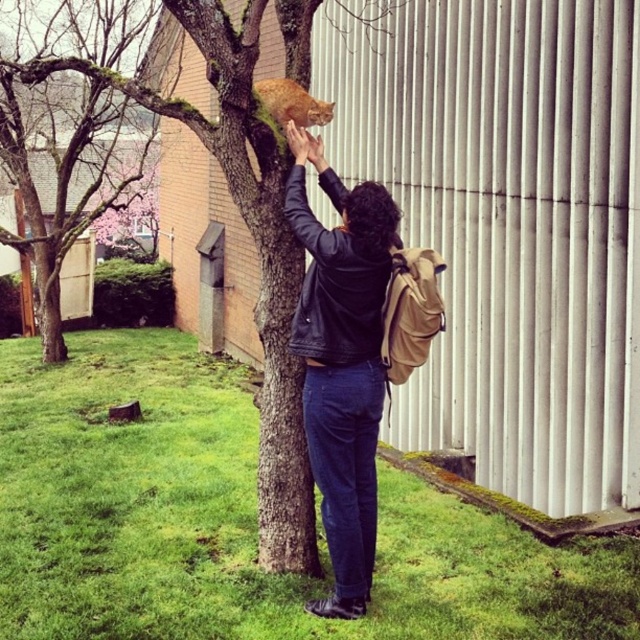
Question: Does black leather jacket at center appear on the left side of green mossy tree at upper left?

Choices:
 (A) no
 (B) yes

Answer: (A)

Question: Which of these objects is positioned farthest from the orange fur cat at upper center?

Choices:
 (A) black leather jacket at center
 (B) green mossy tree at upper center
 (C) green mossy tree at upper left

Answer: (C)

Question: Is black leather jacket at center behind orange fur cat at upper center?

Choices:
 (A) no
 (B) yes

Answer: (A)

Question: Is green mossy tree at upper left smaller than orange fur cat at upper center?

Choices:
 (A) no
 (B) yes

Answer: (B)

Question: Considering the real-world distances, which object is farthest from the black leather jacket at center?

Choices:
 (A) green mossy tree at upper center
 (B) orange fur cat at upper center

Answer: (B)

Question: Which of the following is the closest to the observer?

Choices:
 (A) green mossy tree at upper left
 (B) black leather jacket at center
 (C) orange fur cat at upper center

Answer: (B)